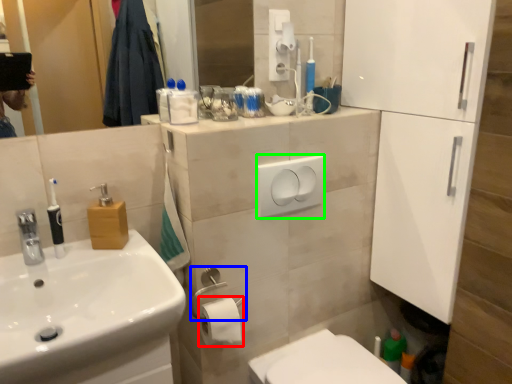
Question: Considering the real-world distances, which object is farthest from toilet paper (highlighted by a red box)? towel bar (highlighted by a blue box) or light switch (highlighted by a green box)?

Choices:
 (A) towel bar
 (B) light switch

Answer: (B)